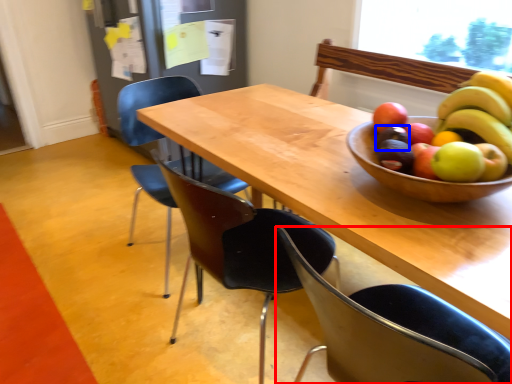
Question: Which point is further to the camera, chair (highlighted by a red box) or avocado (highlighted by a blue box)?

Choices:
 (A) chair
 (B) avocado

Answer: (B)